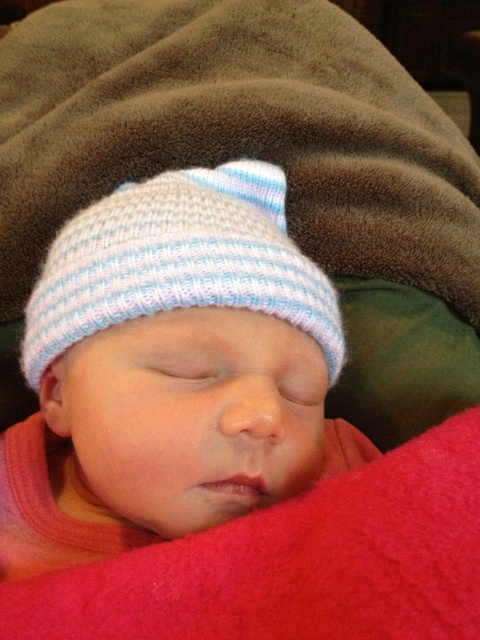
Is white knitted hat at center closer to the viewer compared to red fleece blanket at lower right?

No, it is behind red fleece blanket at lower right.

Can you confirm if white knitted hat at center is smaller than red fleece blanket at lower right?

Incorrect, white knitted hat at center is not smaller in size than red fleece blanket at lower right.

This screenshot has width=480, height=640. I want to click on white knitted hat at center, so click(170, 371).

The height and width of the screenshot is (640, 480). Find the location of `white knitted hat at center`. white knitted hat at center is located at coordinates (170, 371).

Can you confirm if white knitted hat at center is thinner than light blue knitted hat at upper center?

Incorrect, white knitted hat at center's width is not less than light blue knitted hat at upper center's.

Is point (88, 291) closer to camera compared to point (132, 188)?

That is True.

What are the coordinates of `white knitted hat at center` in the screenshot? It's located at (170, 371).

What are the coordinates of `red fleece blanket at lower right` in the screenshot? It's located at (295, 563).

Does point (346, 522) come behind point (252, 280)?

No, it is not.

Where is `red fleece blanket at lower right`? The height and width of the screenshot is (640, 480). red fleece blanket at lower right is located at coordinates (295, 563).

This screenshot has width=480, height=640. Find the location of `red fleece blanket at lower right`. red fleece blanket at lower right is located at coordinates (295, 563).